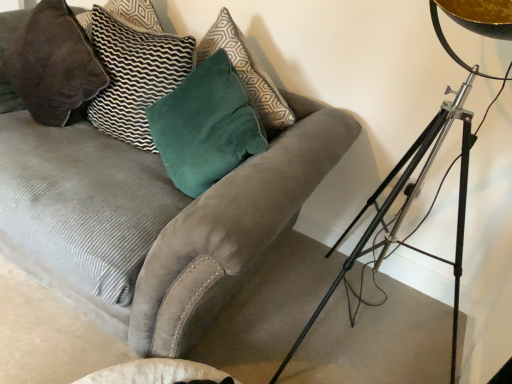
Question: Would you say velvet dark brown pillow at upper left, positioned as the 1th pillow in left-to-right order, is inside or outside velvet gray couch at center?

Choices:
 (A) outside
 (B) inside

Answer: (B)

Question: Considering the positions of velvet dark brown pillow at upper left, the second pillow from the right, and velvet gray couch at center in the image, is velvet dark brown pillow at upper left, the second pillow from the right, wider or thinner than velvet gray couch at center?

Choices:
 (A) wide
 (B) thin

Answer: (B)

Question: Considering the real-world distances, which object is closest to the velvet dark brown pillow at upper left, positioned as the 1th pillow in left-to-right order?

Choices:
 (A) metallic tripod at right
 (B) velvet gray couch at center
 (C) velvet green pillow at upper left, the second pillow positioned from the left

Answer: (C)

Question: Which object is the farthest from the velvet green pillow at upper left, the second pillow positioned from the left?

Choices:
 (A) metallic tripod at right
 (B) velvet gray couch at center
 (C) velvet dark brown pillow at upper left, positioned as the 1th pillow in left-to-right order

Answer: (A)